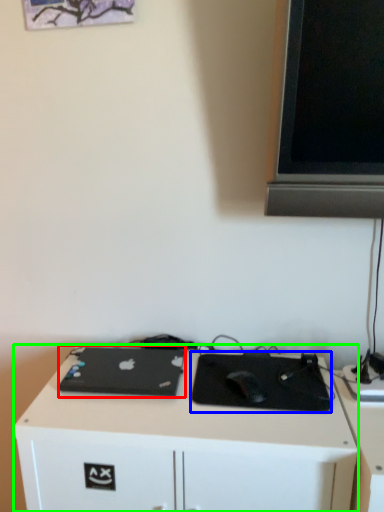
Question: Which object is the farthest from laptop (highlighted by a red box)? Choose among these: mousepad (highlighted by a blue box) or desk (highlighted by a green box).

Choices:
 (A) mousepad
 (B) desk

Answer: (A)